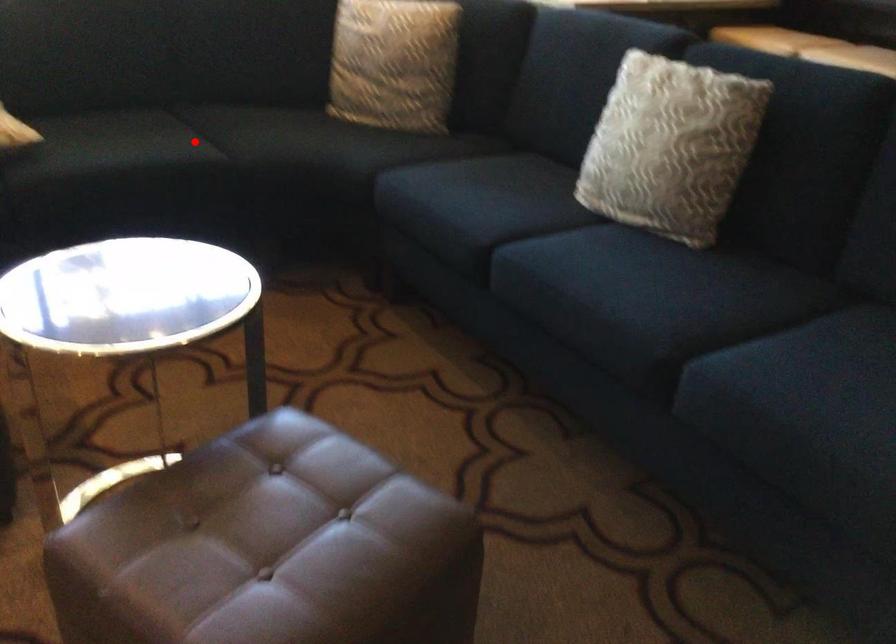
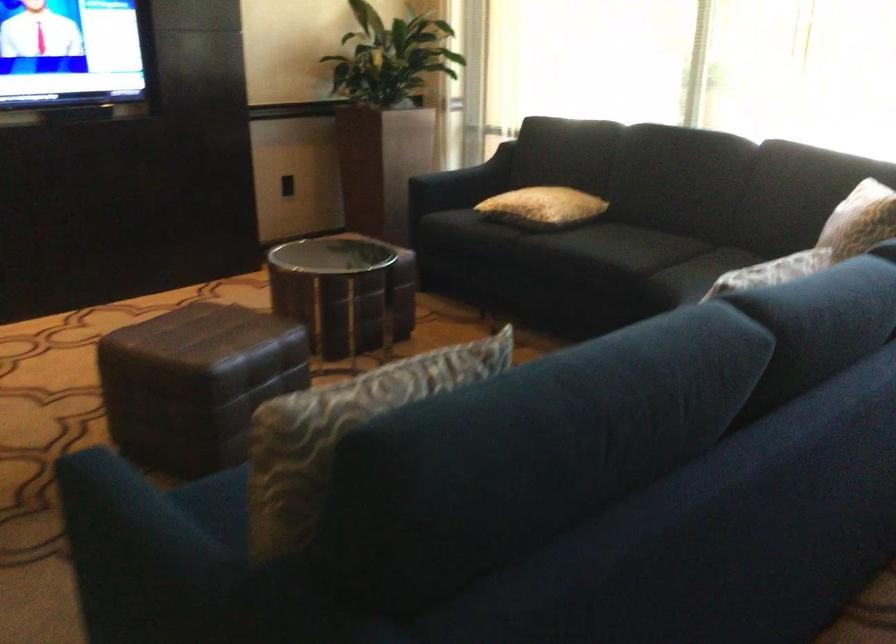
Question: I am providing you with two images of the same scene from different viewpoints. Given a red point in image1, look at the same physical point in image2. Is it:

Choices:
 (A) Closer to the viewpoint
 (B) Farther from the viewpoint

Answer: (B)